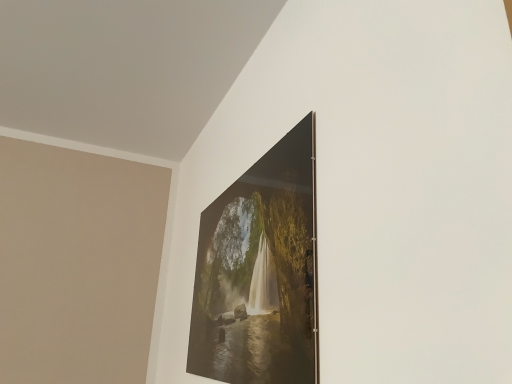
I want to click on metallic glossy picture frame at upper center, so click(260, 272).

The height and width of the screenshot is (384, 512). What do you see at coordinates (260, 272) in the screenshot?
I see `metallic glossy picture frame at upper center` at bounding box center [260, 272].

At what (x,y) coordinates should I click in order to perform the action: click on metallic glossy picture frame at upper center. Please return your answer as a coordinate pair (x, y). This screenshot has width=512, height=384. Looking at the image, I should click on (260, 272).